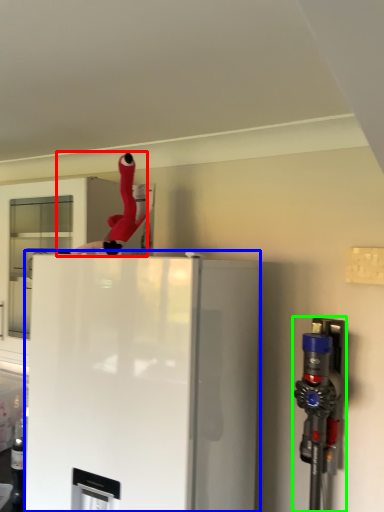
Question: Based on their relative distances, which object is nearer to person (highlighted by a red box)? Choose from refrigerator (highlighted by a blue box) and appliance (highlighted by a green box).

Choices:
 (A) refrigerator
 (B) appliance

Answer: (A)